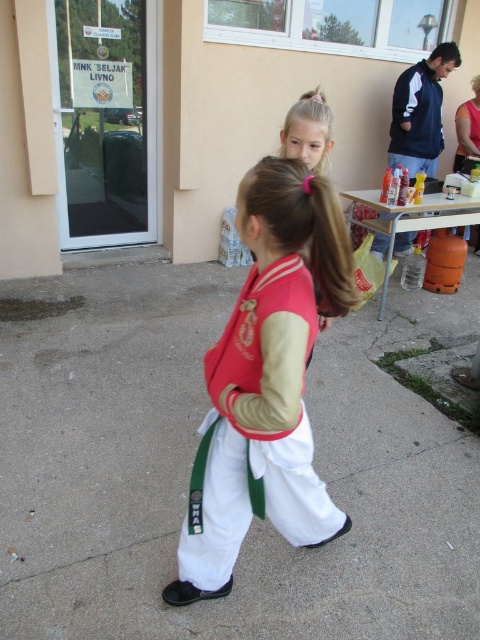
You are a photographer trying to capture a closeup of the girl in the foreground. You notice two points marked on your camera screen at coordinates point (109, 564) and point (321, 536). Which point should you focus on to ensure the girl in the foreground is sharp?

You should focus on point (109, 564) because it is closer to the viewer than point (321, 536), ensuring the foreground girl is in focus.

You are a photographer setting up for a martial arts event. You want to capture a photo where both the white cotton karate uniform at center and the white concrete pavement at center are clearly visible. Based on their positions, will the uniform be in front of or behind the pavement in the photo?

The white cotton karate uniform at center is behind the white concrete pavement at center, so in the photo, the uniform will be behind the pavement.

You are a photographer trying to capture a closeup of the white cotton karate uniform at center. The white concrete pavement at center is in the way. Can you move the karate uniform to the side so it is no longer on the pavement?

The white concrete pavement at center might be wider than white cotton karate uniform at center, so moving the karate uniform to the side may not be necessary since the pavement is wider and could accommodate the uniform without needing to move it. However, since the question is about moving the uniform to avoid the pavement, the answer should clarify based on the description. Wait, the description says the pavement might be wider, so perhaps the uniform can be shifted sideways within the pavement area. But